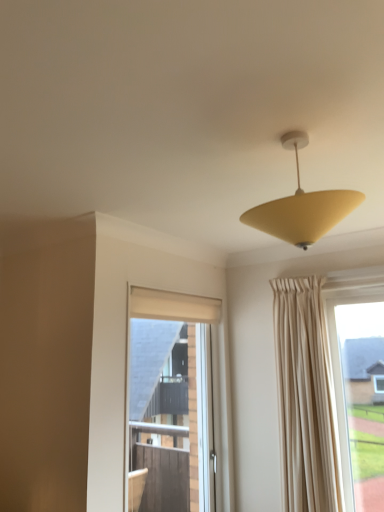
What is the approximate width of matte yellow cone at upper center?

It is 15.24 inches.

Image resolution: width=384 pixels, height=512 pixels. What do you see at coordinates (302, 206) in the screenshot?
I see `matte yellow cone at upper center` at bounding box center [302, 206].

Find the location of a particular element. The width and height of the screenshot is (384, 512). matte yellow cone at upper center is located at coordinates (302, 206).

Measure the distance between matte glass window at center and camera.

The distance of matte glass window at center from camera is 7.31 feet.

What do you see at coordinates (163, 319) in the screenshot?
I see `matte glass window at center` at bounding box center [163, 319].

You are a GUI agent. You are given a task and a screenshot of the screen. Output one action in this format:
    pyautogui.click(x=<x>, y=<y>)
    Task: Click on the matte glass window at center
    This screenshot has height=512, width=384.
    Given the screenshot: What is the action you would take?
    pyautogui.click(x=163, y=319)

The image size is (384, 512). I want to click on matte yellow cone at upper center, so click(x=302, y=206).

Which object is positioned more to the right, matte yellow cone at upper center or matte glass window at center?

matte yellow cone at upper center.

Is the position of matte yellow cone at upper center less distant than that of matte glass window at center?

Yes, matte yellow cone at upper center is in front of matte glass window at center.

Which is in front, point (331, 206) or point (132, 298)?

The point (331, 206) is more forward.

From the image's perspective, which one is positioned higher, matte yellow cone at upper center or matte glass window at center?

matte yellow cone at upper center.

In the scene shown: From a real-world perspective, between matte yellow cone at upper center and matte glass window at center, who is vertically higher?

matte yellow cone at upper center is physically above.

Is matte yellow cone at upper center wider than matte glass window at center?

Yes.

Who is shorter, matte yellow cone at upper center or matte glass window at center?

Standing shorter between the two is matte yellow cone at upper center.

Which of these two, matte yellow cone at upper center or matte glass window at center, is bigger?

matte glass window at center is bigger.

Is matte yellow cone at upper center located outside matte glass window at center?

That's correct, matte yellow cone at upper center is outside of matte glass window at center.

Is matte yellow cone at upper center directly adjacent to matte glass window at center?

No, matte yellow cone at upper center is not beside matte glass window at center.

Is matte yellow cone at upper center looking in the opposite direction of matte glass window at center?

matte yellow cone at upper center does not have its back to matte glass window at center.

Where is `lamp above the matte glass window at center (from a real-world perspective)`? lamp above the matte glass window at center (from a real-world perspective) is located at coordinates (302, 206).

Consider the image. Does matte glass window at center appear on the right side of matte yellow cone at upper center?

In fact, matte glass window at center is to the left of matte yellow cone at upper center.

Does matte glass window at center lie in front of matte yellow cone at upper center?

No.

Is point (142, 296) farther from camera compared to point (246, 223)?

Yes, point (142, 296) is behind point (246, 223).

From the image's perspective, would you say matte glass window at center is positioned over matte yellow cone at upper center?

No, from the image's perspective, matte glass window at center is not above matte yellow cone at upper center.

From a real-world perspective, relative to matte yellow cone at upper center, is matte glass window at center vertically above or below?

In terms of real-world spatial position, matte glass window at center is below matte yellow cone at upper center.

Between matte glass window at center and matte yellow cone at upper center, which one has larger width?

matte yellow cone at upper center is wider.

Is matte glass window at center shorter than matte yellow cone at upper center?

Incorrect, the height of matte glass window at center does not fall short of that of matte yellow cone at upper center.

Between matte glass window at center and matte yellow cone at upper center, which one has larger size?

Bigger between the two is matte glass window at center.

Is matte glass window at center inside the boundaries of matte yellow cone at upper center, or outside?

matte glass window at center is spatially situated outside matte yellow cone at upper center.

Based on the photo, is matte glass window at center in contact with matte yellow cone at upper center?

No, matte glass window at center is not beside matte yellow cone at upper center.

Is matte glass window at center oriented away from matte yellow cone at upper center?

That's not correct — matte glass window at center is not looking away from matte yellow cone at upper center.

Where is `window located behind the matte yellow cone at upper center`? window located behind the matte yellow cone at upper center is located at coordinates (163, 319).

Where is `lamp above the matte glass window at center (from the image's perspective)`? The height and width of the screenshot is (512, 384). lamp above the matte glass window at center (from the image's perspective) is located at coordinates (302, 206).

This screenshot has width=384, height=512. Identify the location of window that appears below the matte yellow cone at upper center (from a real-world perspective). click(163, 319).